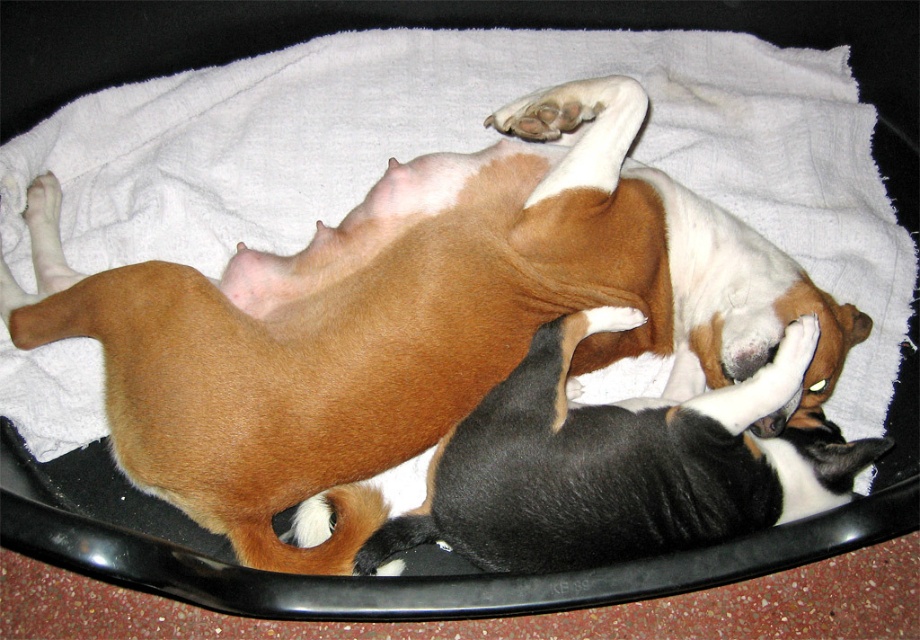
You are a photographer trying to capture a closeup of both the brown smooth dog at upper center and the black and white fur at center. Given that your camera can only focus on objects within a 1 meter width, will both fit in the frame if the camera is set to capture a width of 1 meter?

The brown smooth dog at upper center is wider than the black and white fur at center. Since the camera can focus on objects within a 1 meter width, both will fit as long as their combined width does not exceed 1 meter. However, since the brown smooth dog is wider, it depends on their exact widths. The description only states the brown dog is wider, but not the exact measurement. Without knowing the exact widths, we cannot confirm if both fit within the 1 meter limit.

You are taking a photo of two puppies on a white towel inside a black container. You notice two points marked in the image. Which point is closer to the camera, point (263, 272) or point (801, 344)?

Point (263, 272) is closer to the camera than point (801, 344).